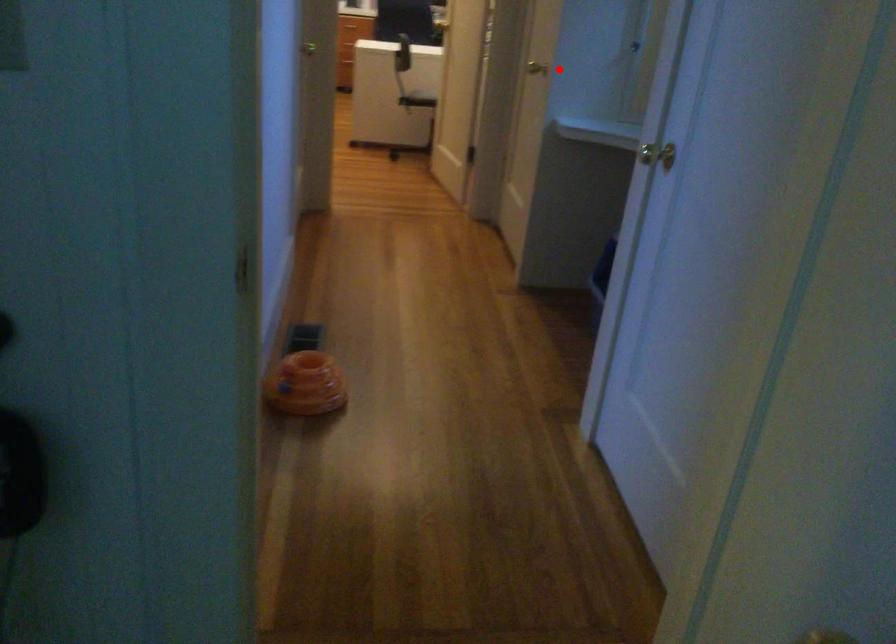
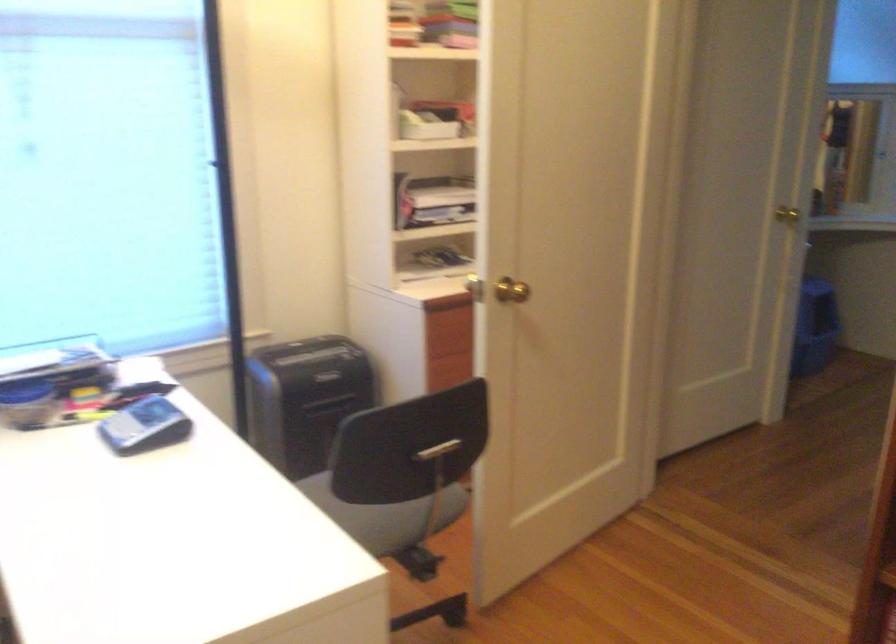
The point at the highlighted location is marked in the first image. Where is the corresponding point in the second image?

(787, 214)